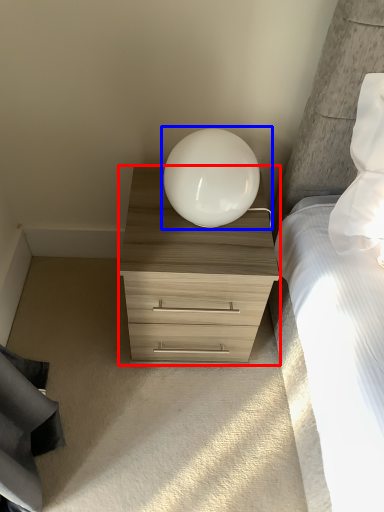
Question: Which of the following is the closest to the observer, chest of drawers (highlighted by a red box) or table lamp (highlighted by a blue box)?

Choices:
 (A) chest of drawers
 (B) table lamp

Answer: (B)